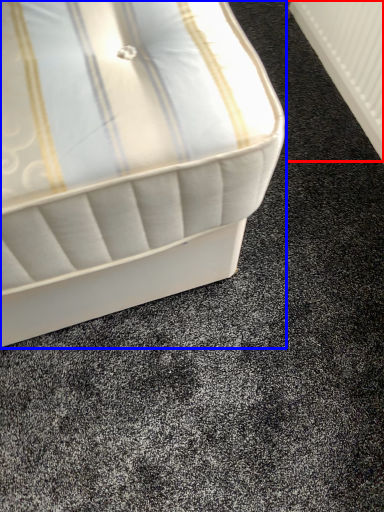
Question: Which object is closer to the camera taking this photo, radiator (highlighted by a red box) or bed (highlighted by a blue box)?

Choices:
 (A) radiator
 (B) bed

Answer: (B)